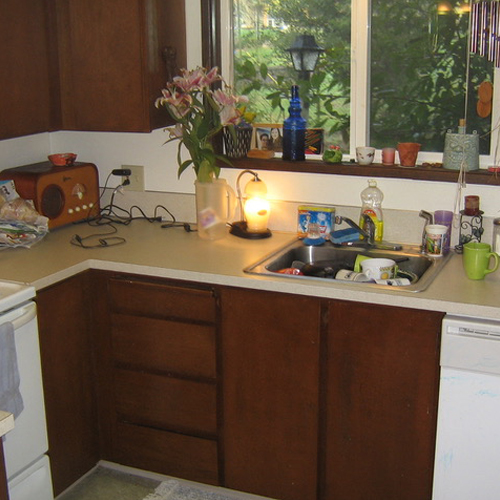
At what (x,y) coordinates should I click in order to perform the action: click on cabinets. Please return your answer as a coordinate pair (x, y). Image resolution: width=500 pixels, height=500 pixels. Looking at the image, I should click on 77,420, 247,420, 338,420, 129,51, 25,73.